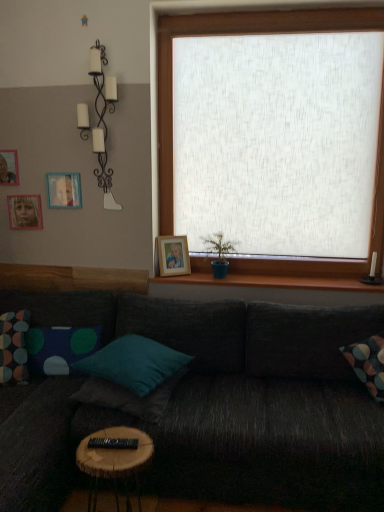
You are a GUI agent. You are given a task and a screenshot of the screen. Output one action in this format:
    pyautogui.click(x=<x>, y=<y>)
    Task: Click on the vacant region under green matte plant at center (from a real-world perspective)
    The image size is (384, 512).
    Given the screenshot: What is the action you would take?
    pyautogui.click(x=218, y=278)